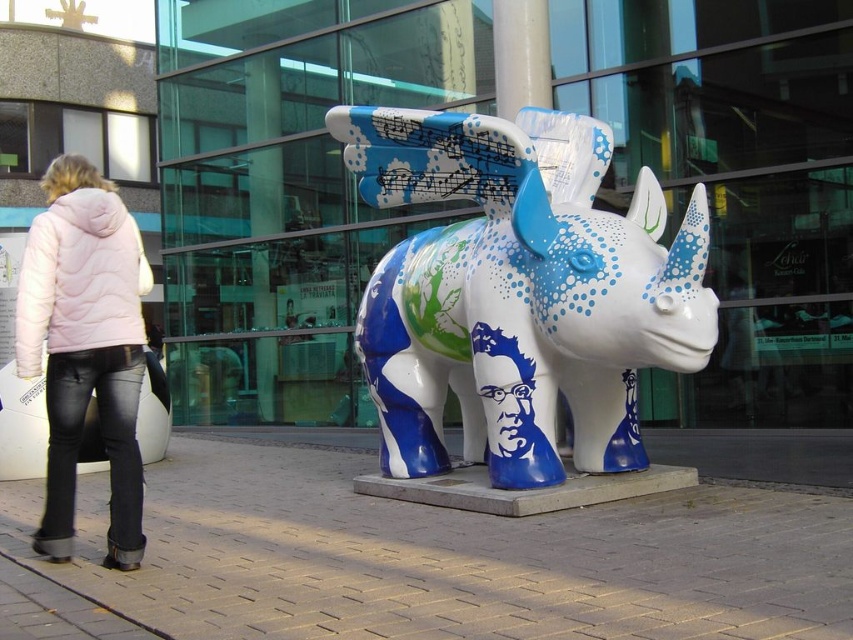
Question: Is shiny ceramic rhino at center thinner than pink quilted jacket at lower left?

Choices:
 (A) no
 (B) yes

Answer: (A)

Question: Does shiny ceramic rhino at center have a greater width compared to pink quilted jacket at lower left?

Choices:
 (A) yes
 (B) no

Answer: (A)

Question: Which point appears closest to the camera in this image?

Choices:
 (A) (73, 420)
 (B) (631, 321)

Answer: (A)

Question: Can you confirm if shiny ceramic rhino at center is positioned to the right of pink quilted jacket at lower left?

Choices:
 (A) yes
 (B) no

Answer: (A)